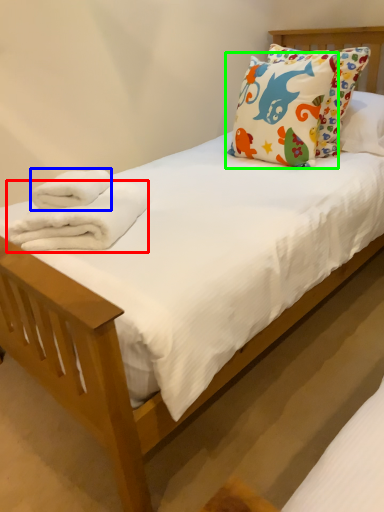
Question: Estimate the real-world distances between objects in this image. Which object is closer to bath towel (highlighted by a red box), bath towel (highlighted by a blue box) or pillow (highlighted by a green box)?

Choices:
 (A) bath towel
 (B) pillow

Answer: (A)